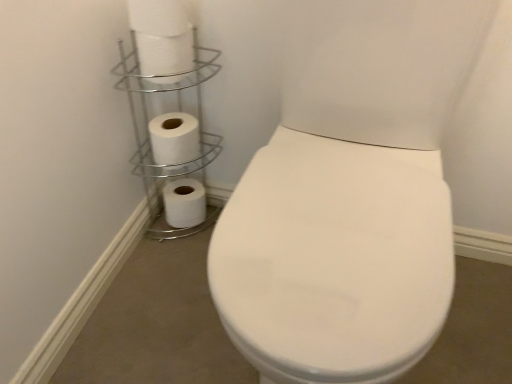
Question: Is white matte toilet paper at upper left, the fourth toilet paper in the bottom-to-top sequence, a part of white matte toilet paper at upper left, the 3th toilet paper in the top-to-bottom sequence?

Choices:
 (A) yes
 (B) no

Answer: (B)

Question: Is white matte toilet paper at upper left, placed as the third toilet paper when sorted from front to back, aimed at white matte toilet paper at upper left, the fourth toilet paper in the bottom-to-top sequence?

Choices:
 (A) yes
 (B) no

Answer: (B)

Question: Is white matte toilet paper at upper left, the 2th toilet paper from the bottom, closer to the viewer compared to white matte toilet paper at upper left, positioned as the 1th toilet paper in top-to-bottom order?

Choices:
 (A) yes
 (B) no

Answer: (B)

Question: Would you say white matte toilet paper at upper left, the 3th toilet paper in the top-to-bottom sequence, is outside white matte toilet paper at upper left, the fourth toilet paper in the bottom-to-top sequence?

Choices:
 (A) yes
 (B) no

Answer: (A)

Question: Does white matte toilet paper at upper left, the 2th toilet paper from the bottom, appear on the right side of white matte toilet paper at upper left, which ranks as the first toilet paper in front-to-back order?

Choices:
 (A) no
 (B) yes

Answer: (A)

Question: From the image's perspective, is white matte toilet paper at upper left, the 2th toilet paper from the bottom, under white matte toilet paper at upper left, positioned as the 1th toilet paper in top-to-bottom order?

Choices:
 (A) no
 (B) yes

Answer: (B)

Question: Is silver/metallic toilet paper holder at upper left outside white matte toilet paper at upper left, placed as the second toilet paper when sorted from top to bottom?

Choices:
 (A) no
 (B) yes

Answer: (B)

Question: Considering the relative sizes of silver/metallic toilet paper holder at upper left and white matte toilet paper at upper left, the 2th toilet paper from the front, in the image provided, is silver/metallic toilet paper holder at upper left taller than white matte toilet paper at upper left, the 2th toilet paper from the front,?

Choices:
 (A) yes
 (B) no

Answer: (A)

Question: From the image's perspective, is silver/metallic toilet paper holder at upper left under white matte toilet paper at upper left, placed as the second toilet paper when sorted from top to bottom?

Choices:
 (A) no
 (B) yes

Answer: (B)

Question: Can you confirm if silver/metallic toilet paper holder at upper left is thinner than white matte toilet paper at upper left, marked as the 3th toilet paper in a bottom-to-top arrangement?

Choices:
 (A) no
 (B) yes

Answer: (A)

Question: Is silver/metallic toilet paper holder at upper left not close to white matte toilet paper at upper left, placed as the second toilet paper when sorted from top to bottom?

Choices:
 (A) yes
 (B) no

Answer: (B)

Question: Is white matte toilet paper at upper left, placed as the second toilet paper when sorted from top to bottom, completely or partially inside silver/metallic toilet paper holder at upper left?

Choices:
 (A) no
 (B) yes

Answer: (A)

Question: Can you confirm if white matte toilet paper at upper left, which is counted as the 4th toilet paper, starting from the back, is shorter than white matte toilet paper at upper left, the 2th toilet paper from the front?

Choices:
 (A) yes
 (B) no

Answer: (B)